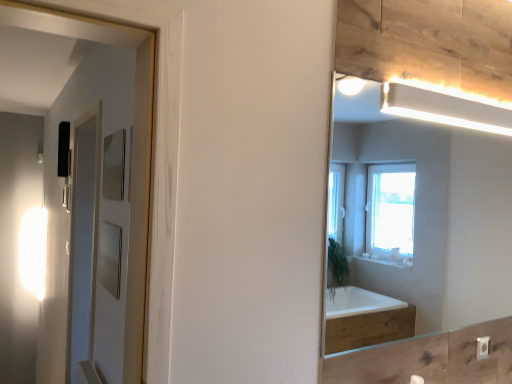
Question: Is point (365, 304) closer or farther from the camera than point (109, 344)?

Choices:
 (A) farther
 (B) closer

Answer: (A)

Question: Based on their sizes in the image, would you say clear glass mirror at upper right is bigger or smaller than transparent glass screen door at left?

Choices:
 (A) big
 (B) small

Answer: (B)

Question: Visually, is clear glass mirror at upper right positioned to the left or to the right of transparent glass screen door at left?

Choices:
 (A) right
 (B) left

Answer: (A)

Question: From the image's perspective, relative to clear glass mirror at upper right, is transparent glass screen door at left above or below?

Choices:
 (A) below
 (B) above

Answer: (A)

Question: Would you say transparent glass screen door at left is inside or outside clear glass mirror at upper right?

Choices:
 (A) outside
 (B) inside

Answer: (A)

Question: Considering the positions of point (92, 297) and point (402, 253), is point (92, 297) closer or farther from the camera than point (402, 253)?

Choices:
 (A) closer
 (B) farther

Answer: (A)

Question: From a real-world perspective, is transparent glass screen door at left positioned above or below clear glass mirror at upper right?

Choices:
 (A) above
 (B) below

Answer: (B)